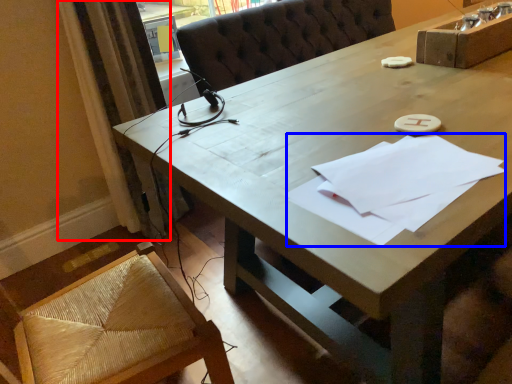
Question: Which of the following is the closest to the observer, curtain (highlighted by a red box) or notepad (highlighted by a blue box)?

Choices:
 (A) curtain
 (B) notepad

Answer: (B)